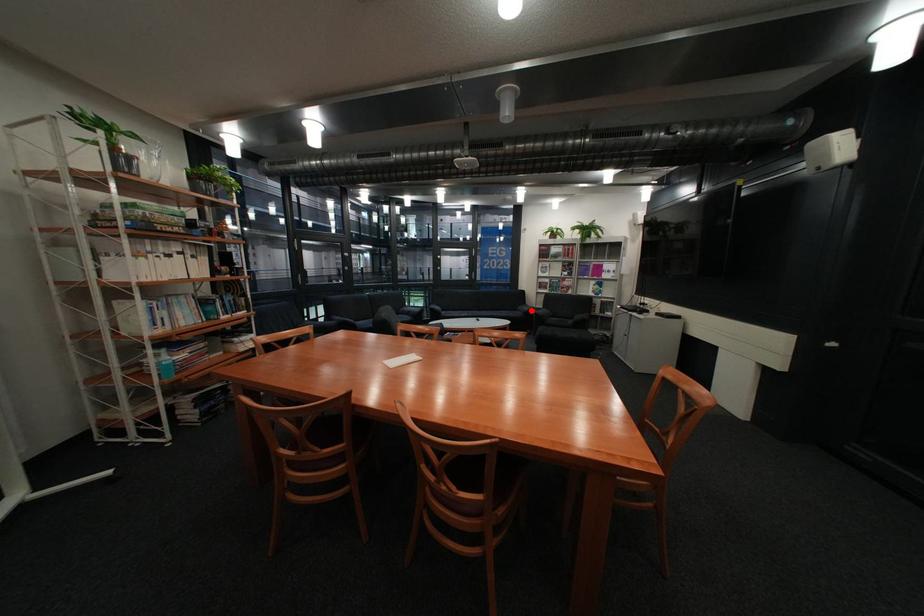
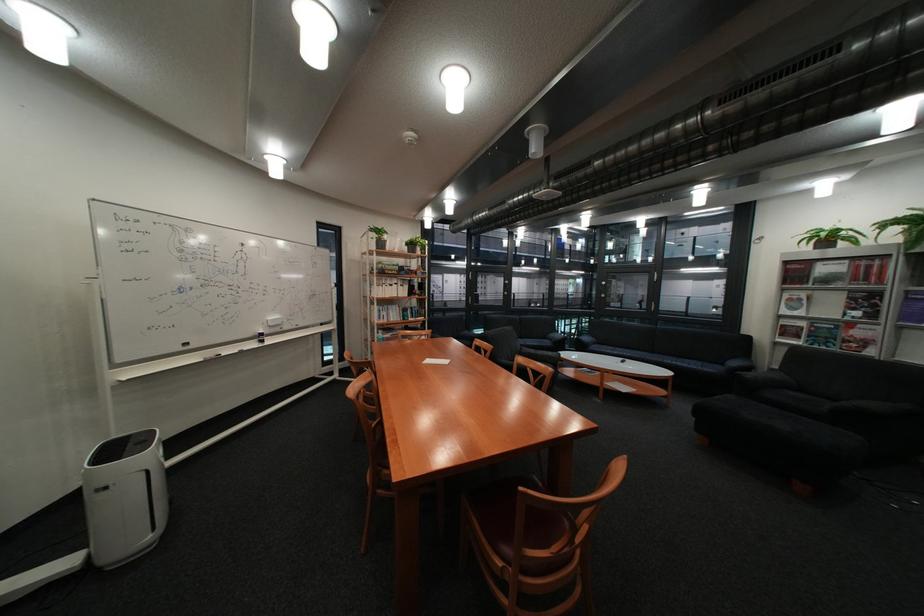
Where in the second image is the point corresponding to the highlighted location from the first image?

(737, 363)